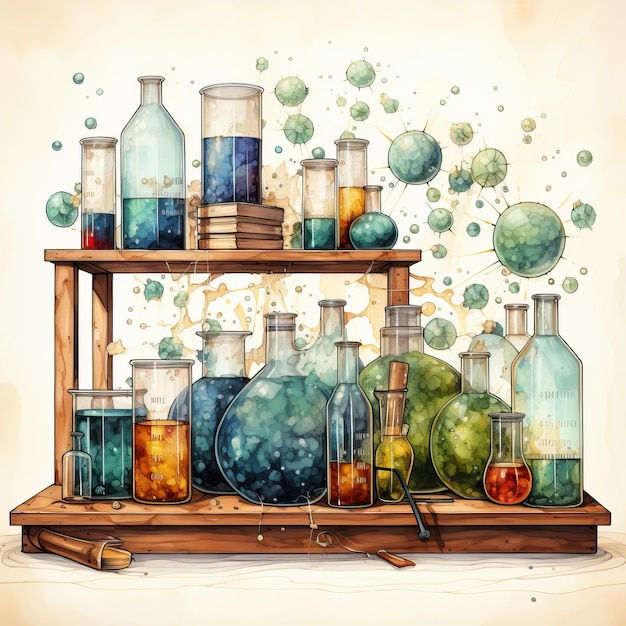
At what (x,y) coordinates should I click in order to perform the action: click on book. Please return your answer as a coordinate pair (x, y). The width and height of the screenshot is (626, 626). Looking at the image, I should click on (238, 228).